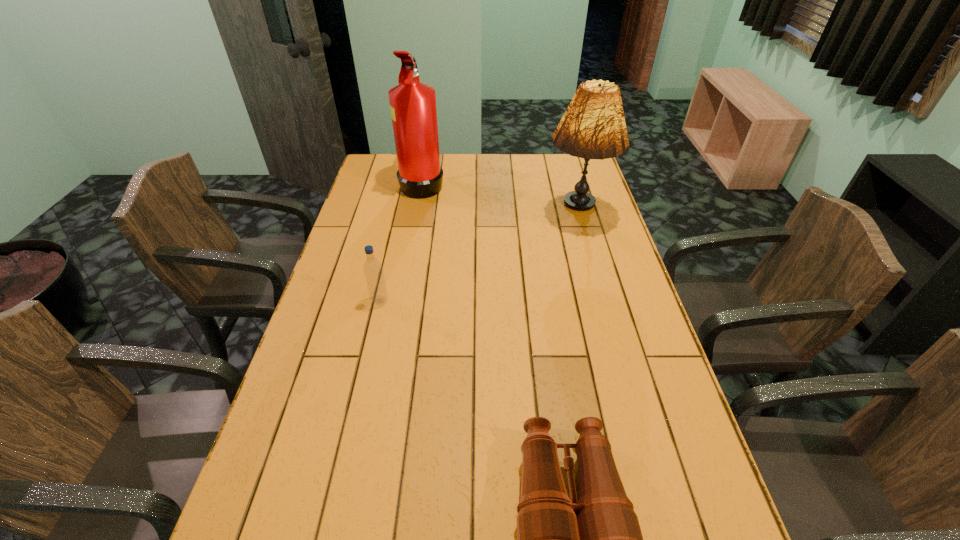
The image size is (960, 540). I want to click on fire extinguisher, so click(412, 103).

I want to click on lampshade, so click(x=593, y=126).

Where is `the second nearest object`? the second nearest object is located at coordinates (373, 270).

You are a GUI agent. You are given a task and a screenshot of the screen. Output one action in this format:
    pyautogui.click(x=<x>, y=<y>)
    Task: Click on the water bottle
    
    Given the screenshot: What is the action you would take?
    pyautogui.click(x=373, y=270)

You are a GUI agent. You are given a task and a screenshot of the screen. Output one action in this format:
    pyautogui.click(x=<x>, y=<y>)
    Task: Click on the free region located at the spray nozzle of the fire extinguisher
    
    Given the screenshot: What is the action you would take?
    pyautogui.click(x=475, y=183)

Identify the location of free space located 0.280m on the front-facing side of the lampshade. (598, 299).

At what (x,y) coordinates should I click in order to perform the action: click on vacant space located on the back of the third tallest object. Please return your answer as a coordinate pair (x, y). The image size is (960, 540). Looking at the image, I should click on (384, 283).

I want to click on object that is positioned at the far edge, so click(412, 103).

Image resolution: width=960 pixels, height=540 pixels. What are the coordinates of `fire extinguisher present at the left edge` in the screenshot? It's located at (412, 103).

The width and height of the screenshot is (960, 540). I want to click on water bottle situated at the left edge, so (x=373, y=270).